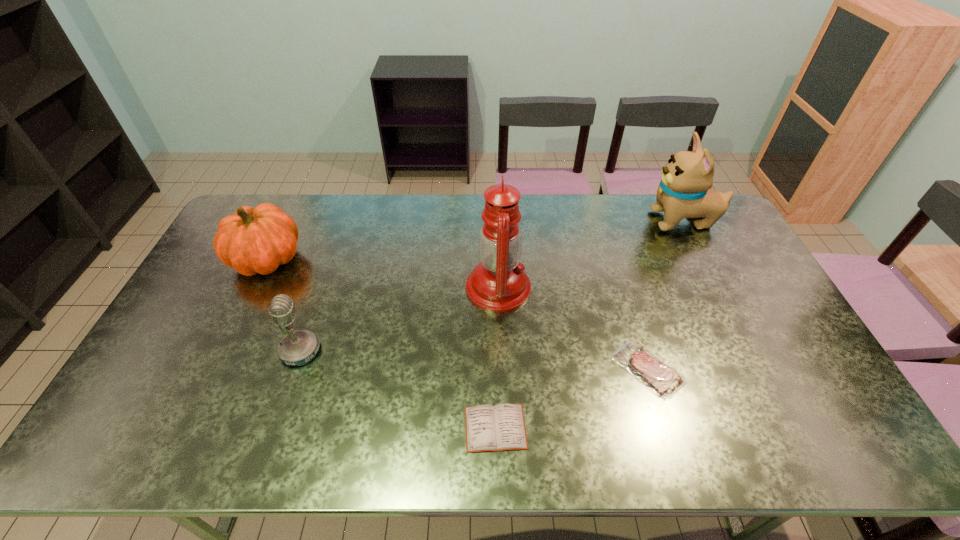
The width and height of the screenshot is (960, 540). I want to click on vacant space in between the shortest object and the oil lamp, so click(x=497, y=357).

Identify the location of vacant area between the nearest object and the rightmost object. (589, 325).

At what (x,y) coordinates should I click in order to perform the action: click on vacant point located between the tallest object and the second object from left to right. Please return your answer as a coordinate pair (x, y). The width and height of the screenshot is (960, 540). Looking at the image, I should click on (399, 319).

Image resolution: width=960 pixels, height=540 pixels. Find the location of `free space that is in between the fifth tallest object and the microphone`. free space that is in between the fifth tallest object and the microphone is located at coordinates (474, 360).

I want to click on vacant area between the nearest object and the fifth tallest object, so click(572, 399).

The width and height of the screenshot is (960, 540). Find the location of `free space between the tallest object and the pumpkin`. free space between the tallest object and the pumpkin is located at coordinates (382, 273).

At what (x,y) coordinates should I click in order to perform the action: click on object that stands as the fifth closest to the leftmost object. Please return your answer as a coordinate pair (x, y). Looking at the image, I should click on (684, 191).

The image size is (960, 540). What are the coordinates of `the fifth closest object relative to the rightmost object` in the screenshot? It's located at (255, 240).

This screenshot has height=540, width=960. What are the coordinates of `vacant space that satisfies the following two spatial constraints: 1. on the front side of the tallest object; 2. on the right side of the fifth object from left to right` in the screenshot? It's located at (501, 369).